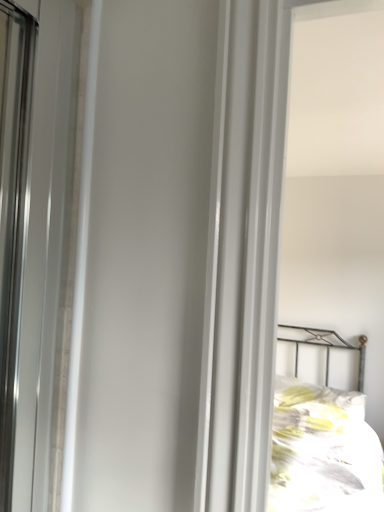
This screenshot has width=384, height=512. What do you see at coordinates (317, 403) in the screenshot?
I see `yellow fabric pillow at lower right` at bounding box center [317, 403].

Image resolution: width=384 pixels, height=512 pixels. I want to click on yellow fabric pillow at lower right, so click(x=317, y=403).

Where is `yellow fabric pillow at lower right`? The width and height of the screenshot is (384, 512). yellow fabric pillow at lower right is located at coordinates 317,403.